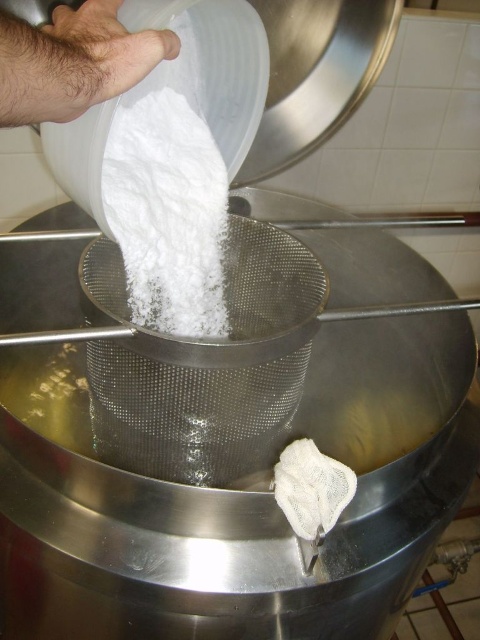
You are a chef working in a commercial kitchen and need to measure the distance between the point where the white plastic container is pouring the white powdery substance and the camera. The container is at point (180, 288). Can you confirm if this distance is within the 70 cm safety zone required for handling dry ingredients?

The point (180, 288) is 71.81 centimeters from the camera, which exceeds the 70 cm safety zone. Therefore, the distance is outside the required safety zone for handling dry ingredients.

You are a chef preparing a dish and need to determine the spatial relationship between the white powder at center and the hairy skin at upper left. Which object occupies more horizontal space in the image?

The white powder at center might be wider than the hairy skin at upper left according to the description.